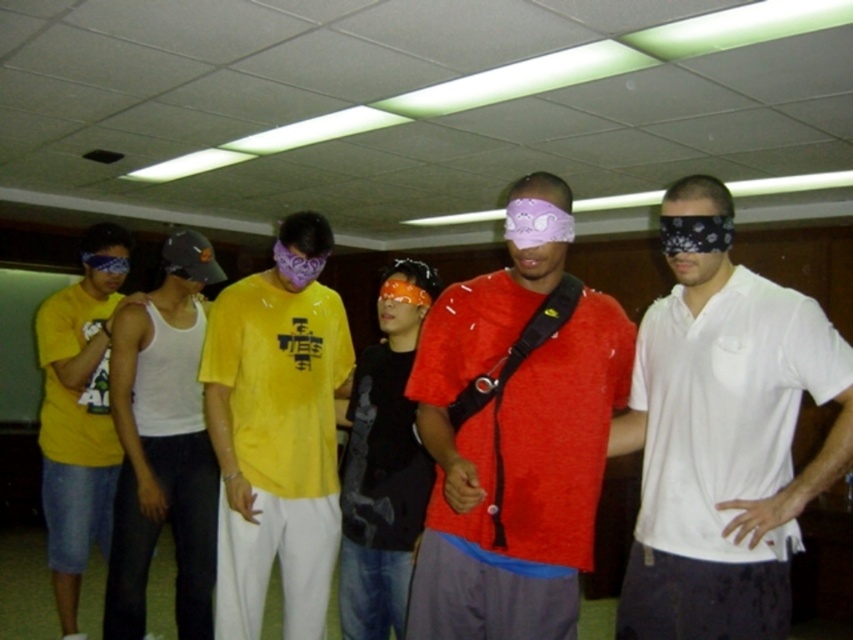
Question: Can you confirm if matte yellow t-shirt at center is thinner than black bandana at center?

Choices:
 (A) no
 (B) yes

Answer: (A)

Question: Which of the following is the closest to the observer?

Choices:
 (A) (422, 540)
 (B) (422, 310)
 (C) (645, 557)
 (D) (517, 253)

Answer: (D)

Question: Which of these objects is positioned farthest from the orange matte mask at center?

Choices:
 (A) white cotton shirt at center
 (B) black bandana at center

Answer: (A)

Question: Where is black bandana at center located in relation to orange matte mask at center in the image?

Choices:
 (A) left
 (B) right

Answer: (B)

Question: Can you confirm if matte yellow t-shirt at left is bigger than orange matte mask at center?

Choices:
 (A) no
 (B) yes

Answer: (B)

Question: Estimate the real-world distances between objects in this image. Which object is closer to the purple fabric blindfold at center?

Choices:
 (A) black bandana at center
 (B) white cotton shirt at center
 (C) matte red shirt at center

Answer: (A)